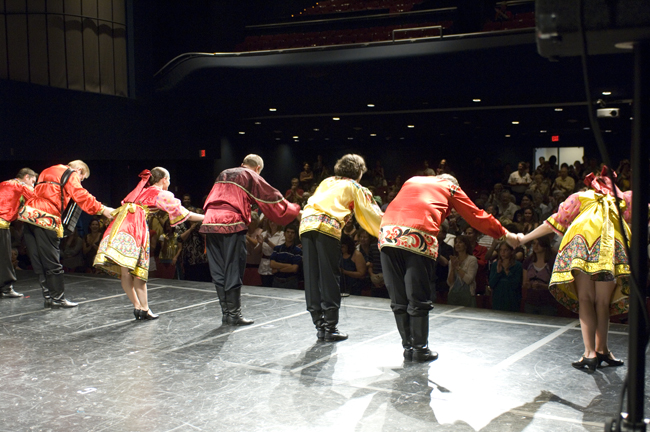
Identify the location of exit sign. (554, 142), (197, 154).